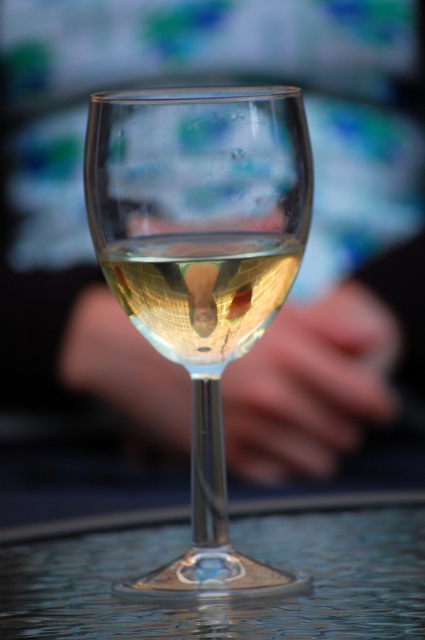
You are standing in a bar and want to place a coaster under the transparent glass wine glass at center. The bartender says the coaster is at coordinate point 0.420, 0.473. Is the coaster already under the glass?

The transparent glass wine glass at center is located at point (x=201, y=268), so the coaster is already under the glass.

You are a bartender trying to clean the transparent glass wine glass at center and the transparent glass at center. Since they are both at the center, how can you tell them apart?

The transparent glass wine glass at center is positioned over the transparent glass at center, so the one below is the transparent glass at center and the one above is the transparent glass wine glass at center.